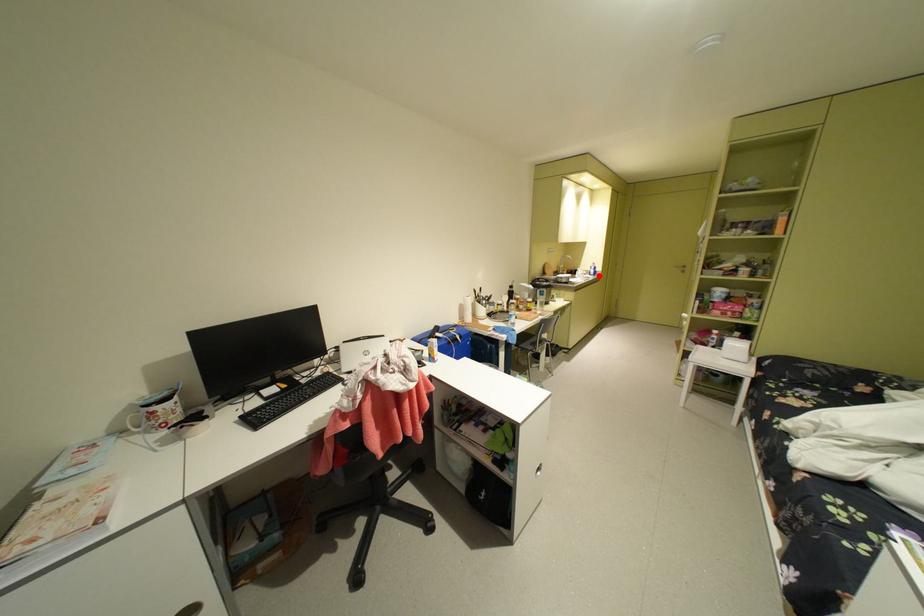
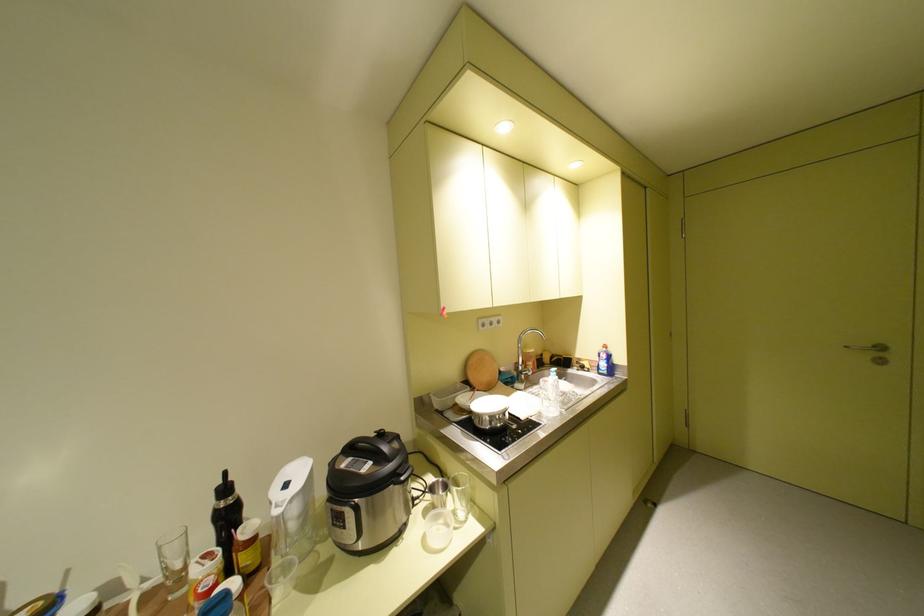
The point at the highlighted location is marked in the first image. Where is the corresponding point in the second image?

(603, 376)